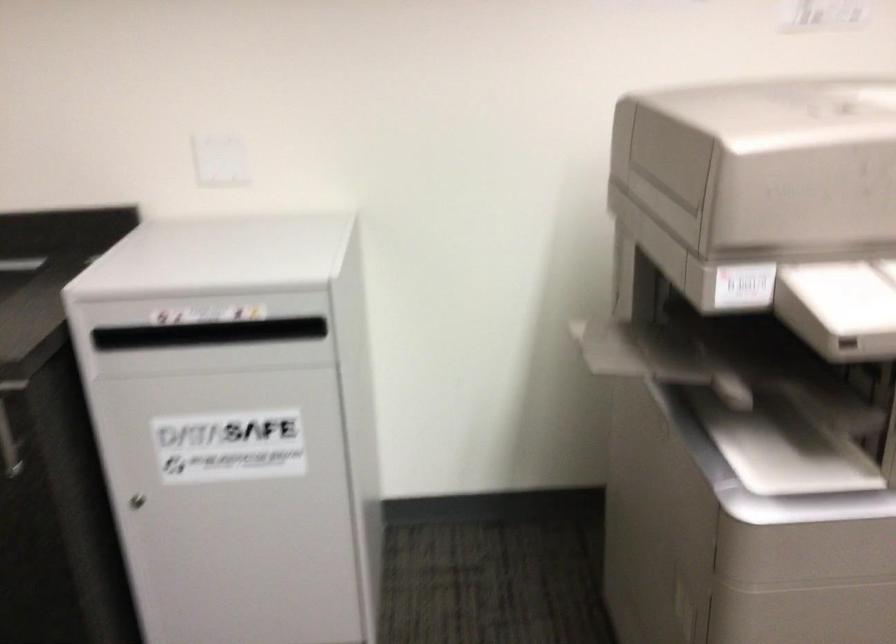
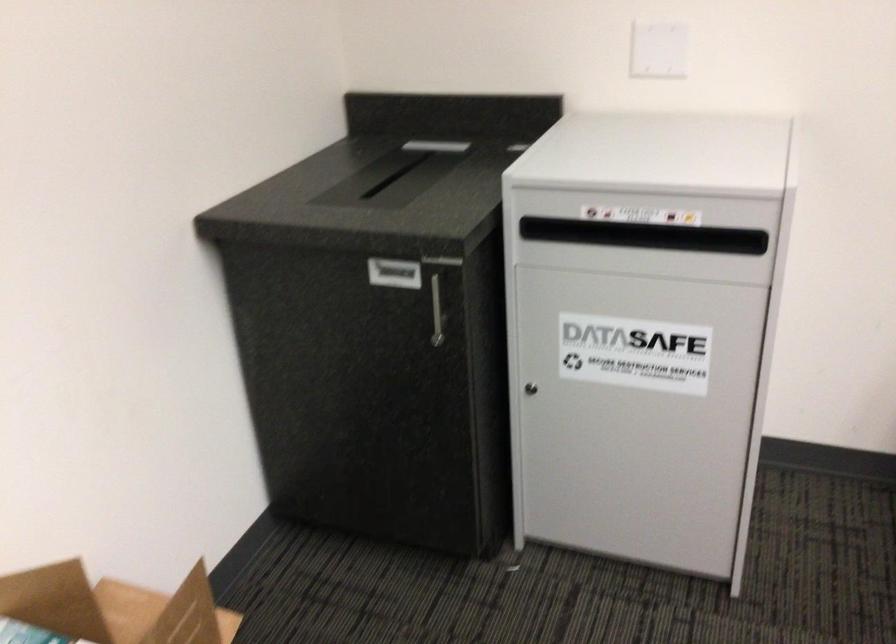
Question: The camera is either moving clockwise (left) or counter-clockwise (right) around the object. The first image is from the beginning of the video and the second image is from the end. Is the camera moving left or right when shooting the video?

Choices:
 (A) Left
 (B) Right

Answer: (B)